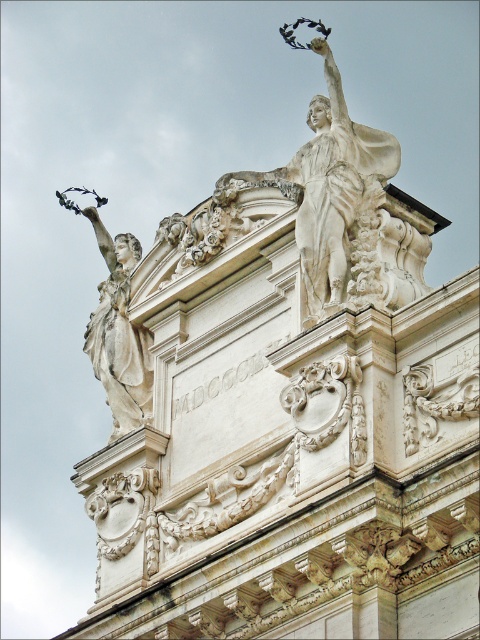
Question: Is white marble statue at upper center in front of white marble statue at left?

Choices:
 (A) yes
 (B) no

Answer: (A)

Question: Is white marble statue at upper center smaller than white marble statue at left?

Choices:
 (A) yes
 (B) no

Answer: (A)

Question: Which point is farther to the camera?

Choices:
 (A) white marble statue at left
 (B) white marble statue at upper center

Answer: (A)

Question: Does white marble statue at upper center appear on the right side of white marble statue at left?

Choices:
 (A) no
 (B) yes

Answer: (B)